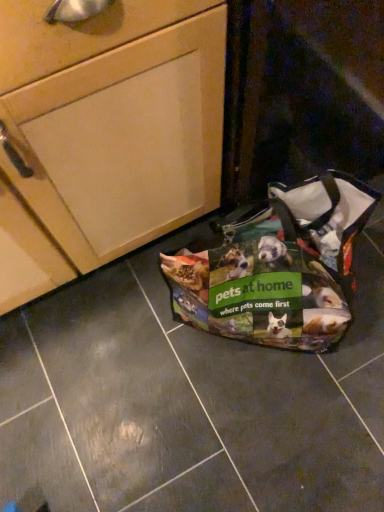
At what (x,y) coordinates should I click in order to perform the action: click on free region on the left part of printed fabric pet carrier at lower right. Please return your answer as a coordinate pair (x, y). This screenshot has width=384, height=512. Looking at the image, I should click on (144, 361).